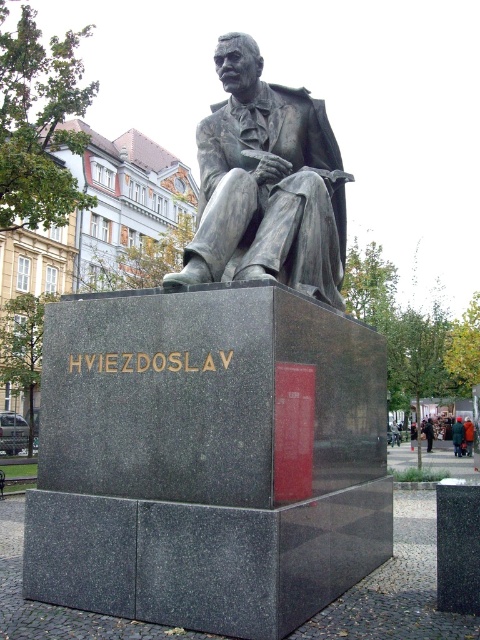
Question: Estimate the real-world distances between objects in this image. Which object is farther from the dark gray suit at center?

Choices:
 (A) matte gray statue at center
 (B) bronze statue at center
 (C) polished bronze statue at center

Answer: (C)

Question: Is bronze statue at center smaller than dark gray suit at center?

Choices:
 (A) yes
 (B) no

Answer: (B)

Question: Which of the following is the closest to the observer?

Choices:
 (A) bronze statue at center
 (B) matte gray statue at center
 (C) polished bronze statue at center
 (D) dark gray suit at center

Answer: (C)

Question: Can you confirm if polished bronze statue at center is wider than dark gray suit at center?

Choices:
 (A) yes
 (B) no

Answer: (A)

Question: Does polished bronze statue at center have a smaller size compared to matte gray statue at center?

Choices:
 (A) yes
 (B) no

Answer: (B)

Question: Which object is positioned farthest from the bronze statue at center?

Choices:
 (A) polished bronze statue at center
 (B) dark gray suit at center
 (C) matte gray statue at center

Answer: (B)